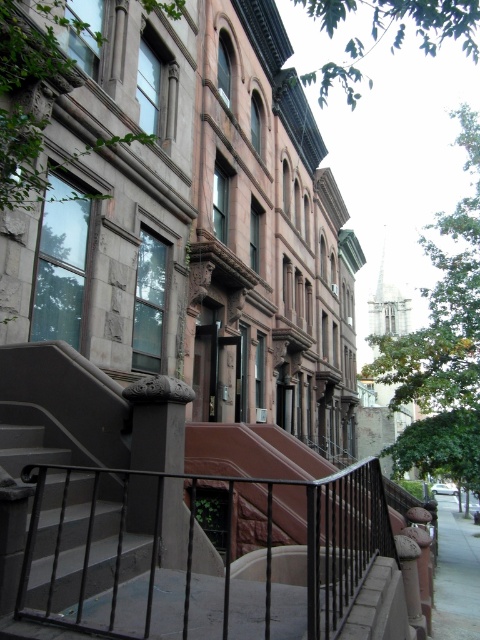
You are a delivery person carrying a large package and need to navigate through the area shown. The black wrought iron at lower center and the gray concrete sidewalk at lower right are both potential paths. Which path offers more space for maneuvering your delivery cart?

The gray concrete sidewalk at lower right offers more space for maneuvering your delivery cart because it occupies more area than the black wrought iron at lower center according to the description.

You are a delivery person trying to navigate through the area. You need to pass between the black wrought iron at lower center and the dark gray concrete stairs at lower left. Can you estimate whether the space between them is wide enough for a standard delivery cart that is 1.2 meters wide?

The black wrought iron at lower center might be wider than dark gray concrete stairs at lower left, but without exact measurements, it is uncertain if the space between them is wide enough for a 1.2 meter delivery cart. Proceed with caution.

You are standing at the base of the stairs in front of the brownstone buildings and notice the black wrought iron at lower center. Based on its position, can you determine if it is closer to the top of the stairs or the bottom?

The black wrought iron at lower center is located at point coordinates that are closer to the bottom of the stairs since its y coordinate is 0.404, which is lower than the midpoint of the image. Therefore, it is closer to the bottom of the stairs.